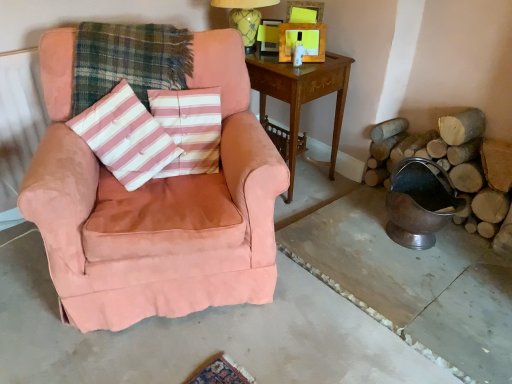
The image size is (512, 384). I want to click on spots to the right of suede pink armchair at left, so click(x=342, y=284).